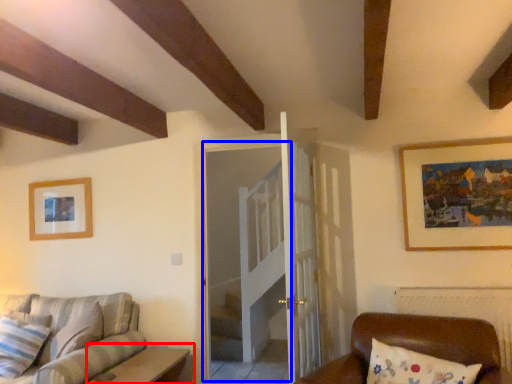
Question: Which of the following is the farthest to the observer, table (highlighted by a red box) or glass door (highlighted by a blue box)?

Choices:
 (A) table
 (B) glass door

Answer: (B)